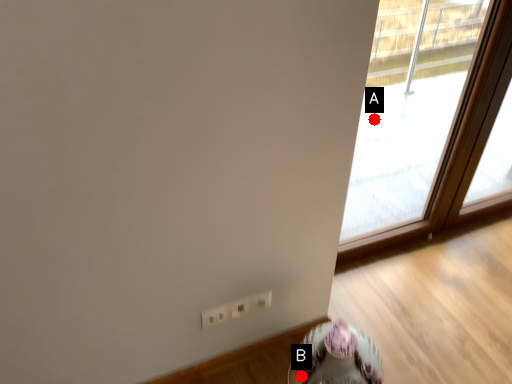
Question: Two points are circled on the image, labeled by A and B beside each circle. Which point is further to the camera?

Choices:
 (A) A is further
 (B) B is further

Answer: (A)